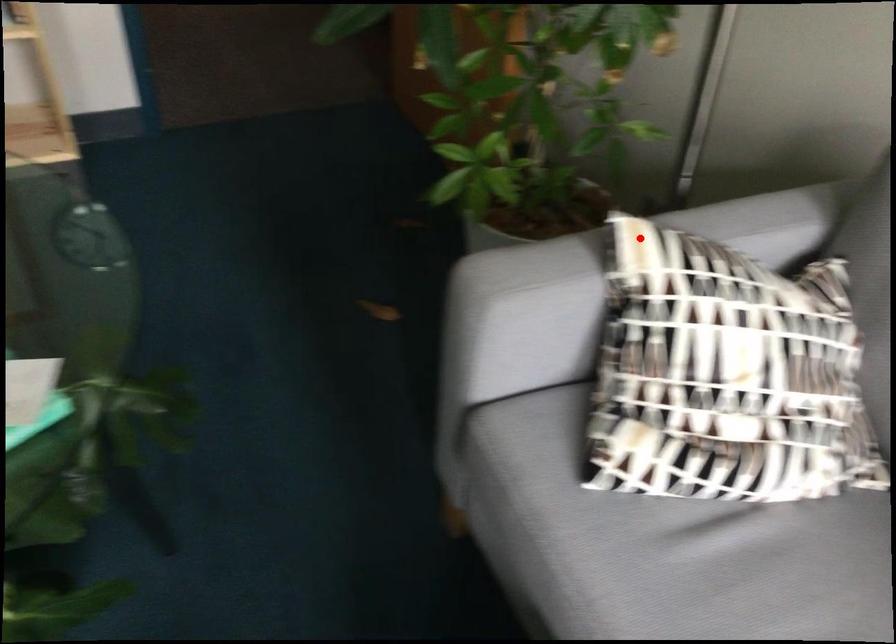
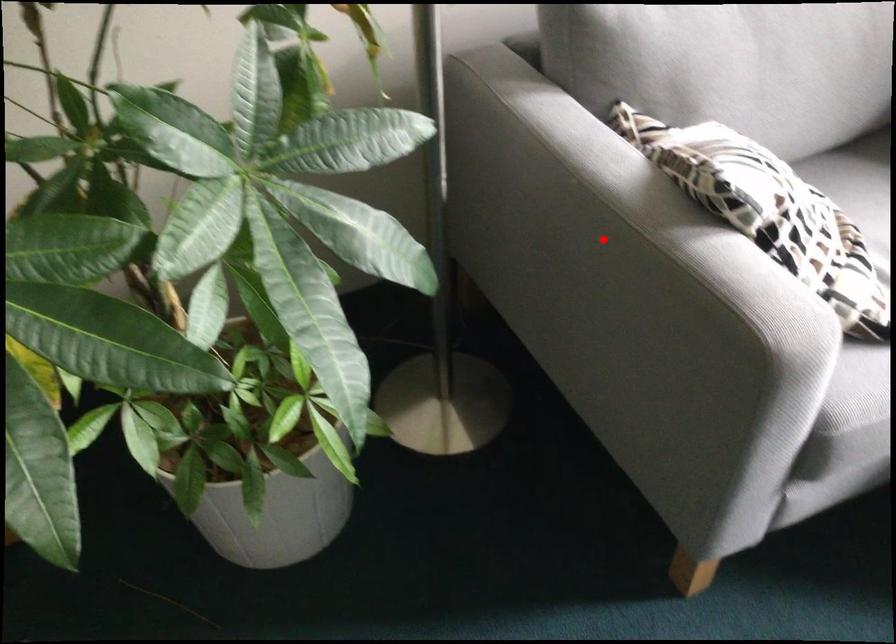
I am providing you with two images of the same scene from different viewpoints. A red point is marked on the first image and another point is marked on the second image. Are the points marked in image1 and image2 representing the same 3D position?

Yes